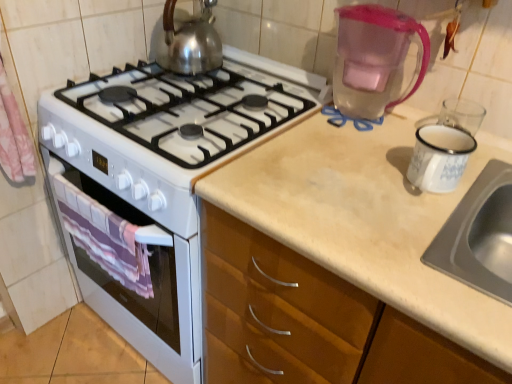
Question: Considering the relative positions of transparent plastic pitcher at upper right and shiny metallic kettle at upper center in the image provided, is transparent plastic pitcher at upper right to the left of shiny metallic kettle at upper center from the viewer's perspective?

Choices:
 (A) yes
 (B) no

Answer: (B)

Question: Would you say transparent plastic pitcher at upper right contains shiny metallic kettle at upper center?

Choices:
 (A) no
 (B) yes

Answer: (A)

Question: From a real-world perspective, is transparent plastic pitcher at upper right located higher than shiny metallic kettle at upper center?

Choices:
 (A) yes
 (B) no

Answer: (A)

Question: Can you confirm if transparent plastic pitcher at upper right is shorter than shiny metallic kettle at upper center?

Choices:
 (A) no
 (B) yes

Answer: (A)

Question: From the image's perspective, is transparent plastic pitcher at upper right on shiny metallic kettle at upper center?

Choices:
 (A) no
 (B) yes

Answer: (A)

Question: Is transparent plastic pitcher at upper right to the right of shiny metallic kettle at upper center from the viewer's perspective?

Choices:
 (A) yes
 (B) no

Answer: (A)

Question: Considering the relative sizes of shiny metallic kettle at upper center and purple striped towel at lower left in the image provided, is shiny metallic kettle at upper center smaller than purple striped towel at lower left?

Choices:
 (A) yes
 (B) no

Answer: (B)

Question: Is the depth of shiny metallic kettle at upper center greater than that of purple striped towel at lower left?

Choices:
 (A) yes
 (B) no

Answer: (A)

Question: Can you confirm if shiny metallic kettle at upper center is positioned to the right of purple striped towel at lower left?

Choices:
 (A) yes
 (B) no

Answer: (A)

Question: Is purple striped towel at lower left completely or partially inside shiny metallic kettle at upper center?

Choices:
 (A) no
 (B) yes

Answer: (A)

Question: Is shiny metallic kettle at upper center facing away from purple striped towel at lower left?

Choices:
 (A) yes
 (B) no

Answer: (B)

Question: Does shiny metallic kettle at upper center have a lesser width compared to purple striped towel at lower left?

Choices:
 (A) no
 (B) yes

Answer: (A)

Question: Is the depth of shiny metallic kettle at upper center greater than that of transparent plastic pitcher at upper right?

Choices:
 (A) no
 (B) yes

Answer: (B)